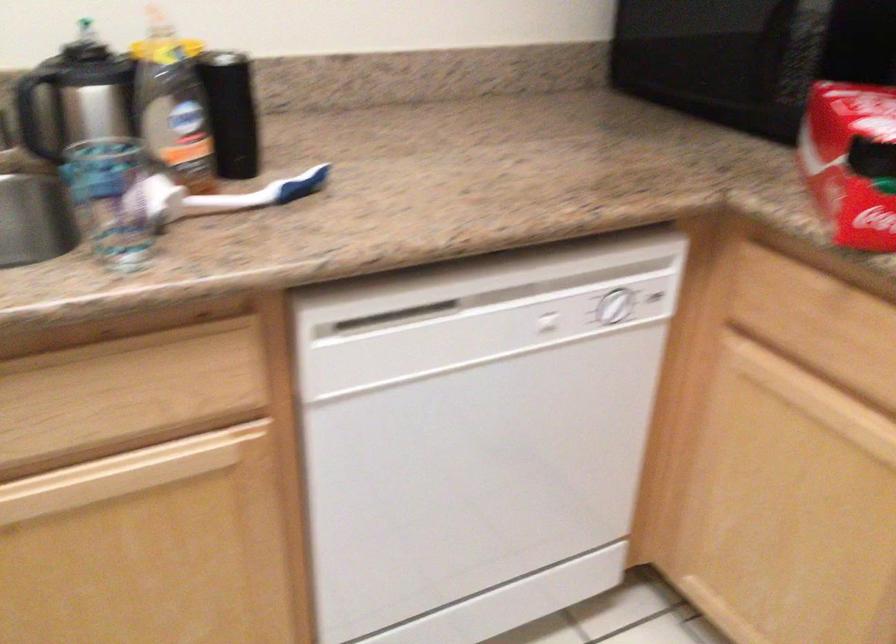
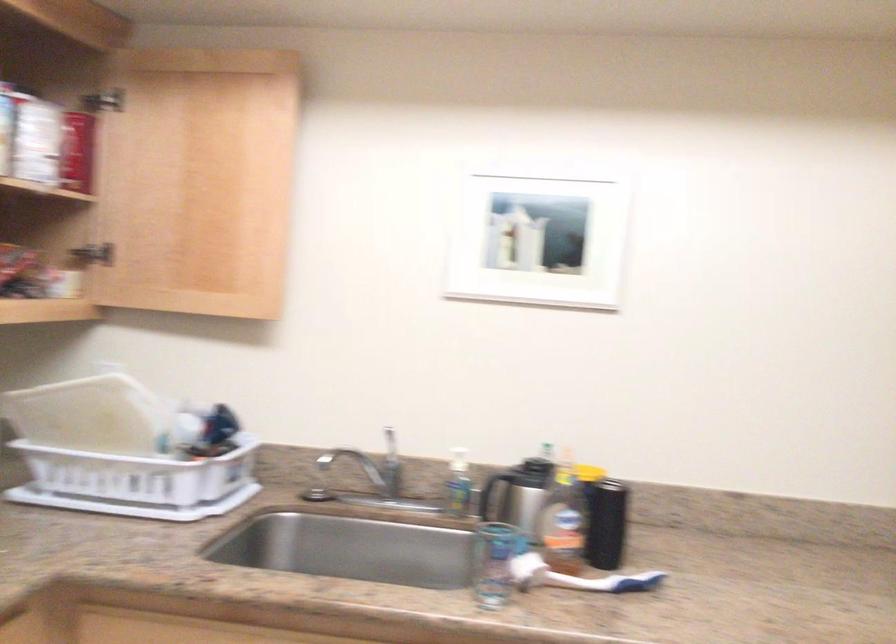
The point at (376, 69) is marked in the first image. Where is the corresponding point in the second image?

(765, 506)